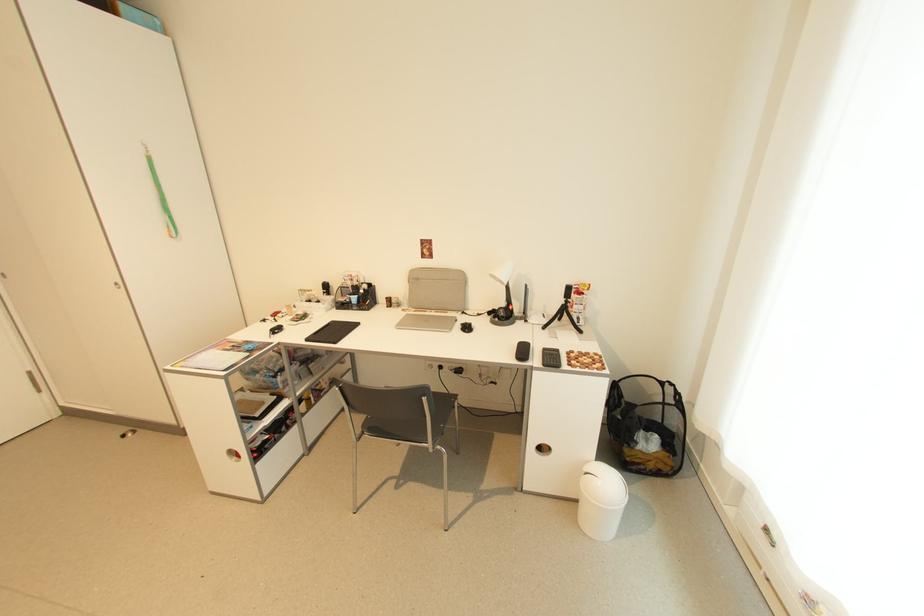
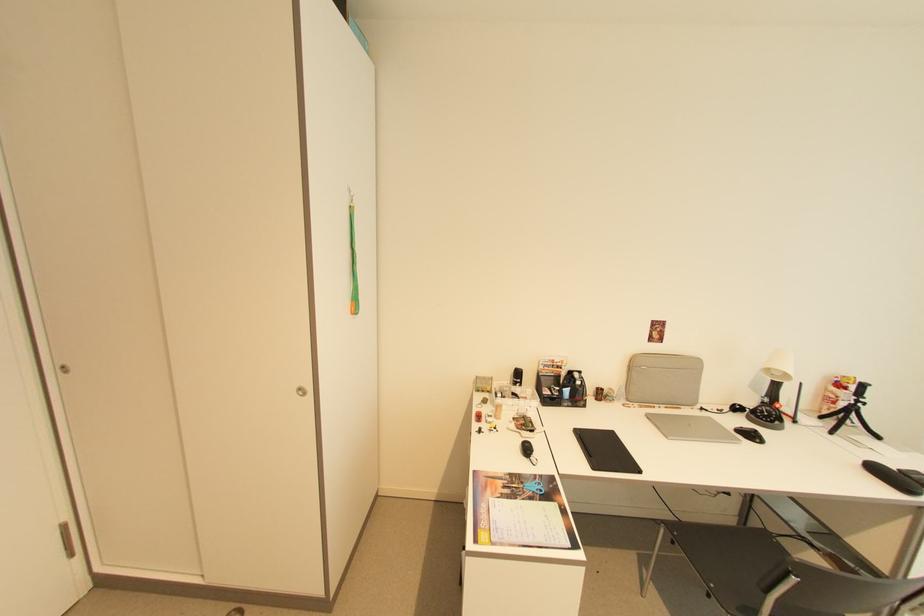
In the second image, find the point that corresponds to (568,304) in the first image.

(857, 405)